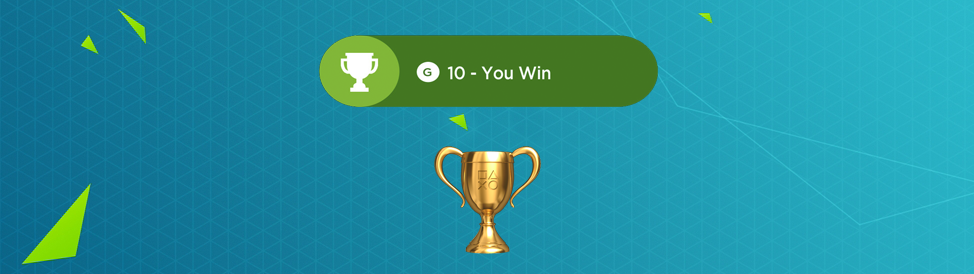
The width and height of the screenshot is (974, 274). In order to click on gold trophy in this screenshot , I will do `click(490, 198)`.